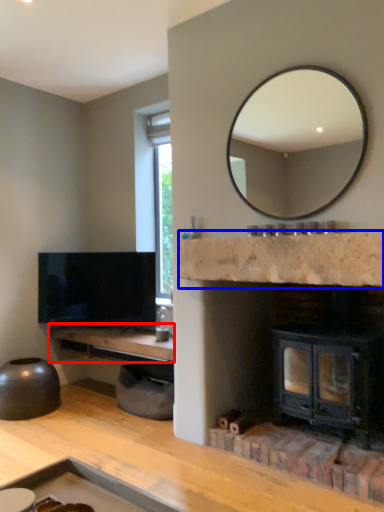
Question: Among these objects, which one is nearest to the camera, counter top (highlighted by a red box) or counter top (highlighted by a blue box)?

Choices:
 (A) counter top
 (B) counter top

Answer: (B)